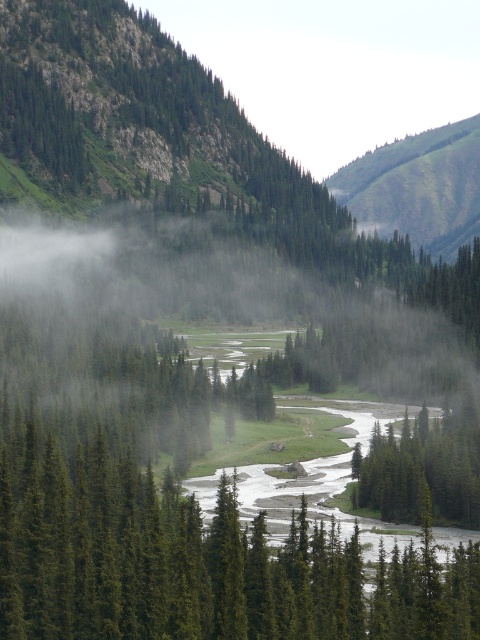
Is green matte tree at center shorter than green grassy hillside at upper right?

Yes, green matte tree at center is shorter than green grassy hillside at upper right.

Does green matte tree at center have a greater width compared to green grassy hillside at upper right?

In fact, green matte tree at center might be narrower than green grassy hillside at upper right.

Describe the element at coordinates (199, 561) in the screenshot. I see `green matte tree at center` at that location.

Locate an element on the screen. This screenshot has width=480, height=640. green matte tree at center is located at coordinates (199, 561).

Which of these two, green matte tree at center or green matte tree at upper left, stands shorter?

With less height is green matte tree at center.

Is green matte tree at center bigger than green matte tree at upper left?

Yes, green matte tree at center is bigger than green matte tree at upper left.

Which is behind, point (132, 541) or point (32, 88)?

Positioned behind is point (32, 88).

This screenshot has width=480, height=640. Find the location of `green matte tree at center`. green matte tree at center is located at coordinates (199, 561).

Which is more to the right, green matte tree at lower right or green matte tree at upper left?

green matte tree at lower right

Who is more distant from viewer, (407, 416) or (37, 93)?

The point (37, 93) is behind.

Find the location of a particular element. green matte tree at lower right is located at coordinates (420, 472).